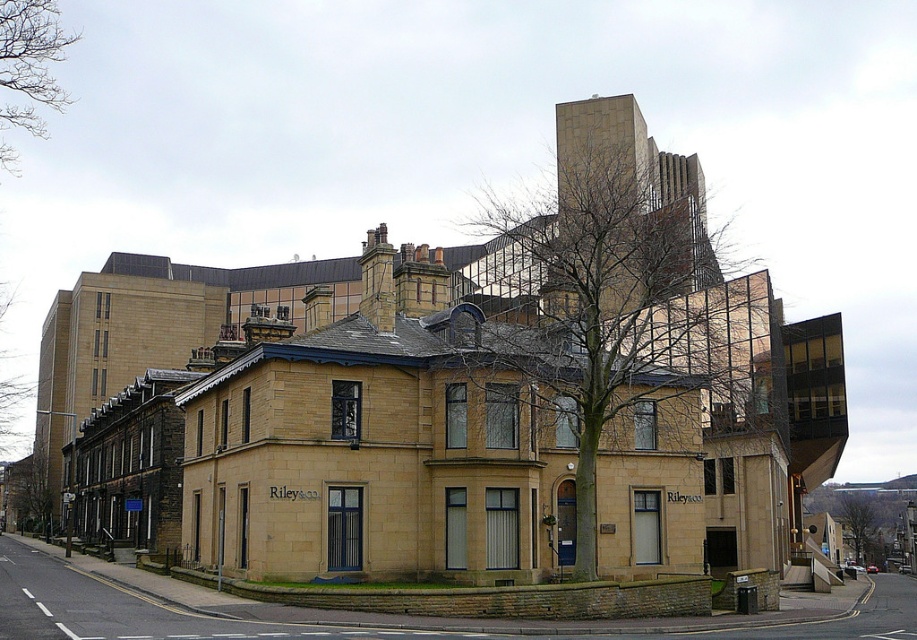
Where is `bare branches at center`? bare branches at center is located at coordinates coord(614,376).

What do you see at coordinates (614, 376) in the screenshot? Image resolution: width=917 pixels, height=640 pixels. I see `bare branches at center` at bounding box center [614, 376].

Measure the distance between point (705, 316) and camera.

A distance of 64.91 meters exists between point (705, 316) and camera.

The width and height of the screenshot is (917, 640). I want to click on bare branches at center, so (x=614, y=376).

In the scene shown: Measure the distance between bare branches at upper left and camera.

bare branches at upper left is 45.21 meters away from camera.

Can you confirm if bare branches at upper left is positioned above green leafy tree at center?

Yes, bare branches at upper left is above green leafy tree at center.

Who is more distant from viewer, (x=4, y=12) or (x=866, y=516)?

Point (x=866, y=516)

This screenshot has height=640, width=917. What are the coordinates of `bare branches at upper left` in the screenshot? It's located at (28, 67).

Who is higher up, bare branches at center or bare branches at upper left?

bare branches at upper left is higher up.

Who is more forward, (764, 515) or (70, 42)?

Positioned in front is point (764, 515).

Measure the distance between point (x=518, y=352) and camera.

A distance of 139.17 feet exists between point (x=518, y=352) and camera.

Where is `bare branches at center`? bare branches at center is located at coordinates (614, 376).